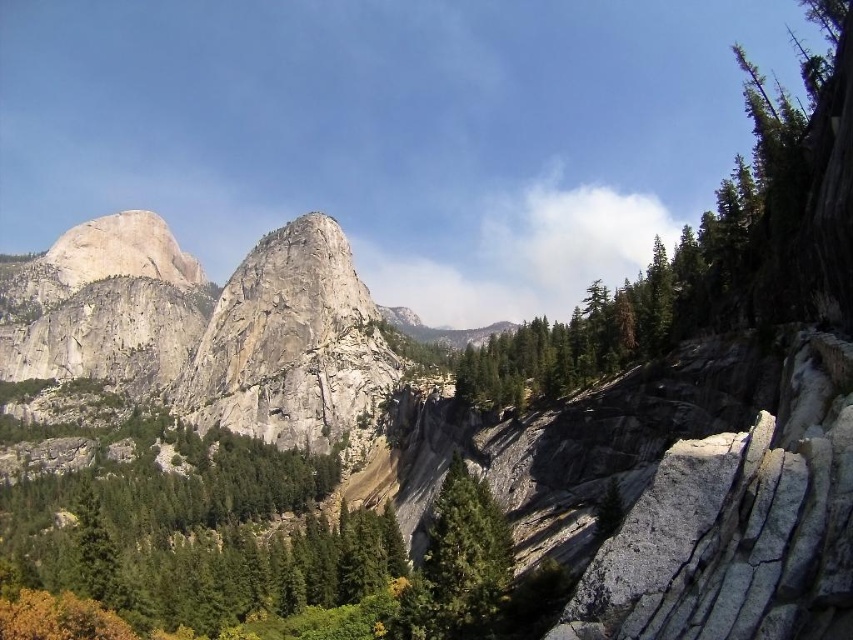
You are a geologist analyzing the mountain landscape. You need to locate the green textured rock at upper right. What are its coordinates in the image?

The green textured rock at upper right is located at coordinates point (711, 250).